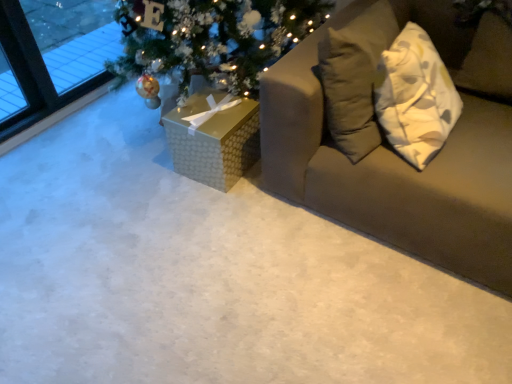
The height and width of the screenshot is (384, 512). Describe the element at coordinates (214, 141) in the screenshot. I see `gold textured gift box at center` at that location.

At what (x,y) coordinates should I click in order to perform the action: click on gold textured gift box at center. Please return your answer as a coordinate pair (x, y). Looking at the image, I should click on (214, 141).

From the picture: Measure the distance between gold textured gift box at center and camera.

They are 1.70 meters apart.

The width and height of the screenshot is (512, 384). What do you see at coordinates (397, 154) in the screenshot? I see `textured beige couch at right` at bounding box center [397, 154].

Locate an element on the screen. textured beige couch at right is located at coordinates (397, 154).

Locate an element on the screen. Image resolution: width=512 pixels, height=384 pixels. gold textured gift box at center is located at coordinates click(214, 141).

Which is more to the left, gold textured gift box at center or textured beige couch at right?

gold textured gift box at center is more to the left.

Who is more distant, gold textured gift box at center or textured beige couch at right?

gold textured gift box at center.

Which is closer to the camera, (215,148) or (284,179)?

Point (215,148) is positioned farther from the camera compared to point (284,179).

From the image's perspective, is gold textured gift box at center over textured beige couch at right?

No, from the image's perspective, gold textured gift box at center is not over textured beige couch at right.

From a real-world perspective, is gold textured gift box at center positioned above or below textured beige couch at right?

In terms of real-world spatial position, gold textured gift box at center is below textured beige couch at right.

Is gold textured gift box at center wider or thinner than textured beige couch at right?

In the image, gold textured gift box at center appears to be more narrow than textured beige couch at right.

Considering the sizes of gold textured gift box at center and textured beige couch at right in the image, is gold textured gift box at center taller or shorter than textured beige couch at right?

Clearly, gold textured gift box at center is shorter compared to textured beige couch at right.

Considering the sizes of objects gold textured gift box at center and textured beige couch at right in the image provided, who is bigger, gold textured gift box at center or textured beige couch at right?

textured beige couch at right.

Do you think gold textured gift box at center is within textured beige couch at right, or outside of it?

gold textured gift box at center lies outside textured beige couch at right.

Is gold textured gift box at center next to textured beige couch at right?

No, gold textured gift box at center is not touching textured beige couch at right.

Is gold textured gift box at center aimed at textured beige couch at right?

No, gold textured gift box at center is not facing towards textured beige couch at right.

How different are the orientations of gold textured gift box at center and textured beige couch at right in degrees?

The angle between the facing direction of gold textured gift box at center and the facing direction of textured beige couch at right is 3.62 degrees.

Identify the location of furniture lying below the textured beige couch at right (from the image's perspective). (214, 141).

Is textured beige couch at right at the left side of gold textured gift box at center?

No.

Is textured beige couch at right further to the viewer compared to gold textured gift box at center?

That is False.

Is point (387, 9) positioned in front of point (240, 139)?

Yes, it is in front of point (240, 139).

From the image's perspective, is textured beige couch at right over gold textured gift box at center?

Yes, from the image's perspective, textured beige couch at right is over gold textured gift box at center.

From a real-world perspective, is textured beige couch at right on top of gold textured gift box at center?

Correct, in the physical world, textured beige couch at right is higher than gold textured gift box at center.

Which of these two, textured beige couch at right or gold textured gift box at center, is thinner?

gold textured gift box at center is thinner.

Which of these two, textured beige couch at right or gold textured gift box at center, stands taller?

Standing taller between the two is textured beige couch at right.

Between textured beige couch at right and gold textured gift box at center, which one has smaller size?

Smaller between the two is gold textured gift box at center.

Is textured beige couch at right completely or partially outside of gold textured gift box at center?

textured beige couch at right lies outside gold textured gift box at center's area.

Is there a large distance between textured beige couch at right and gold textured gift box at center?

textured beige couch at right is actually quite close to gold textured gift box at center.

Could you tell me if textured beige couch at right is turned towards gold textured gift box at center?

No, textured beige couch at right is not aimed at gold textured gift box at center.

Measure the distance between textured beige couch at right and gold textured gift box at center.

textured beige couch at right and gold textured gift box at center are 18.26 inches apart.

This screenshot has width=512, height=384. In order to click on furniture located on the left of textured beige couch at right in this screenshot , I will do `click(214, 141)`.

Where is `furniture on the left side of textured beige couch at right`? Image resolution: width=512 pixels, height=384 pixels. furniture on the left side of textured beige couch at right is located at coordinates (214, 141).

You are a GUI agent. You are given a task and a screenshot of the screen. Output one action in this format:
    pyautogui.click(x=<x>, y=<y>)
    Task: Click on the furniture that is behind the textured beige couch at right
    
    Given the screenshot: What is the action you would take?
    pyautogui.click(x=214, y=141)